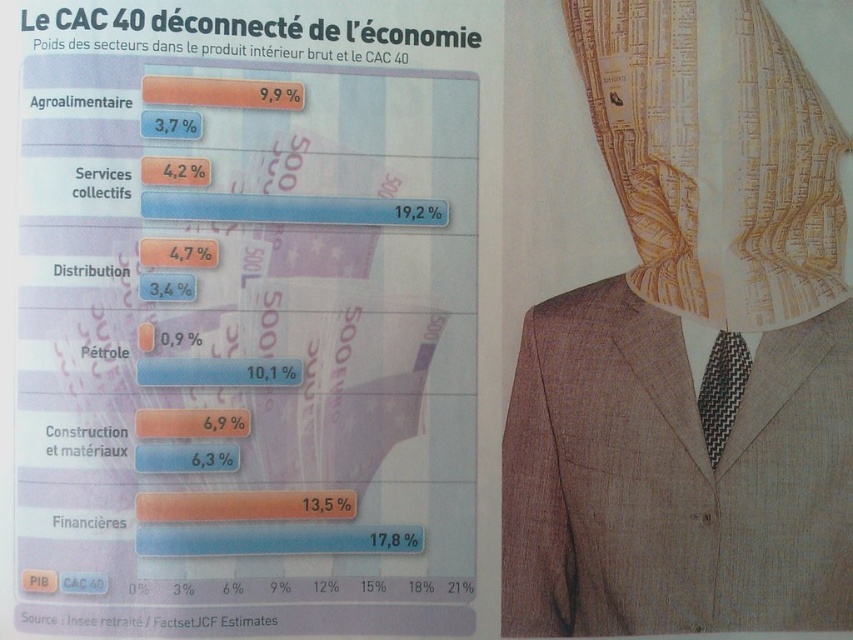
You are an art curator examining the composite image. The matte paper chart at upper left and the gold textured veil at upper right are two key elements. Which of these elements is positioned to the right side of the image?

The gold textured veil at upper right is positioned to the right side of the image as it is to the right of the matte paper chart at upper left.

You are analyzing the bar chart on the left and the stylized figure on the right. You notice two points labeled as point 1 at coordinates [827,339] and point 2 at [729,22]. Which point is closer to you?

Point 1 at coordinates [827,339] is closer to you than point 2 at [729,22] because it is further to the viewer according to the description.